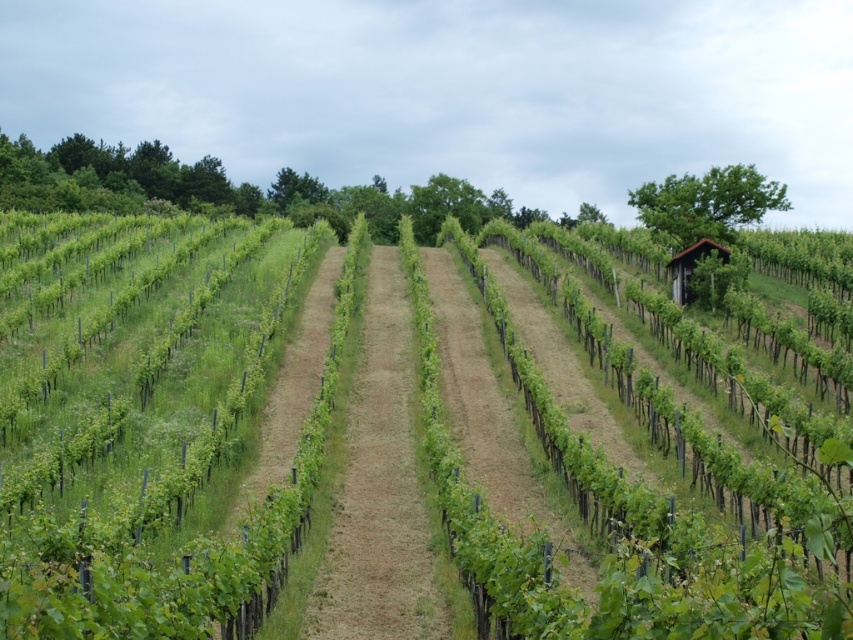
Can you confirm if green leafy vines at center is positioned to the right of green grass at center?

Incorrect, green leafy vines at center is not on the right side of green grass at center.

Does green leafy vines at center appear on the left side of green grass at center?

Correct, you'll find green leafy vines at center to the left of green grass at center.

This screenshot has width=853, height=640. What do you see at coordinates (152, 428) in the screenshot?
I see `green leafy vines at center` at bounding box center [152, 428].

The width and height of the screenshot is (853, 640). What are the coordinates of `green leafy vines at center` in the screenshot? It's located at (152, 428).